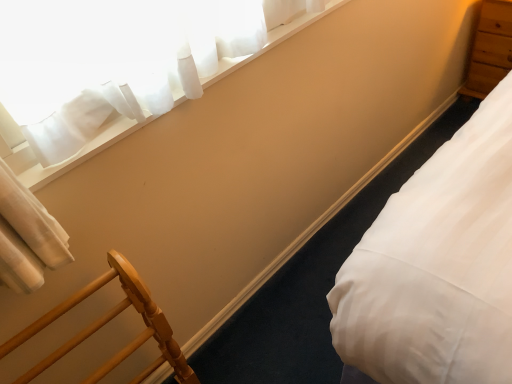
Question: From a real-world perspective, is white sheer curtain at upper left positioned over wooden chair at lower left based on gravity?

Choices:
 (A) yes
 (B) no

Answer: (A)

Question: From the image's perspective, is white sheer curtain at upper left above wooden chair at lower left?

Choices:
 (A) yes
 (B) no

Answer: (A)

Question: Does white sheer curtain at upper left appear on the right side of wooden chair at lower left?

Choices:
 (A) no
 (B) yes

Answer: (B)

Question: From the image's perspective, would you say white sheer curtain at upper left is shown under wooden chair at lower left?

Choices:
 (A) yes
 (B) no

Answer: (B)

Question: Is white sheer curtain at upper left shorter than wooden chair at lower left?

Choices:
 (A) yes
 (B) no

Answer: (A)

Question: Is white sheer curtain at upper left touching wooden chair at lower left?

Choices:
 (A) yes
 (B) no

Answer: (B)

Question: Is white sheer curtain at upper left facing towards light brown wood dresser at upper right?

Choices:
 (A) yes
 (B) no

Answer: (B)

Question: From a real-world perspective, is white sheer curtain at upper left under light brown wood dresser at upper right?

Choices:
 (A) no
 (B) yes

Answer: (A)

Question: From the image's perspective, is white sheer curtain at upper left beneath light brown wood dresser at upper right?

Choices:
 (A) yes
 (B) no

Answer: (A)

Question: Considering the relative positions of white sheer curtain at upper left and light brown wood dresser at upper right in the image provided, is white sheer curtain at upper left behind light brown wood dresser at upper right?

Choices:
 (A) yes
 (B) no

Answer: (B)

Question: Can we say white sheer curtain at upper left lies outside light brown wood dresser at upper right?

Choices:
 (A) yes
 (B) no

Answer: (A)

Question: Is white sheer curtain at upper left beside light brown wood dresser at upper right?

Choices:
 (A) no
 (B) yes

Answer: (A)

Question: Could you tell me if light brown wood dresser at upper right is turned towards white smooth bed at lower right?

Choices:
 (A) no
 (B) yes

Answer: (B)